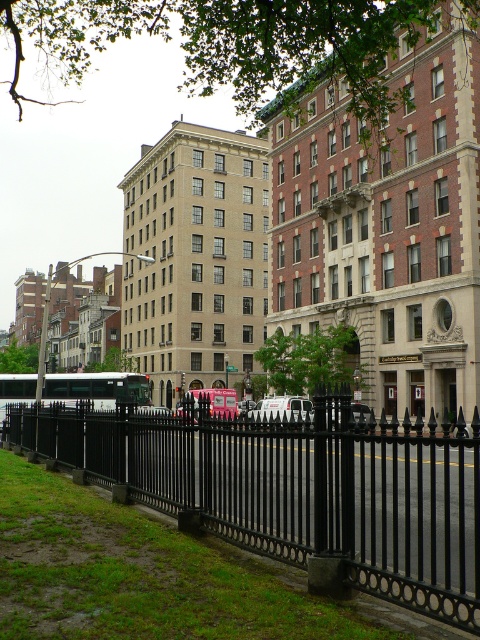
Question: Considering the real-world distances, which object is closest to the white matte bus at center?

Choices:
 (A) metallic silver bus at center
 (B) black wrought iron fence at lower left
 (C) white matte van at center

Answer: (B)

Question: Based on their relative distances, which object is farther from the metallic silver bus at center?

Choices:
 (A) black wrought iron fence at lower left
 (B) white matte bus at center

Answer: (B)

Question: Which of these objects is positioned closest to the black wrought iron fence at lower left?

Choices:
 (A) white matte bus at center
 (B) white matte van at center

Answer: (A)

Question: Considering the relative positions of black wrought iron fence at lower left and white matte van at center in the image provided, where is black wrought iron fence at lower left located with respect to white matte van at center?

Choices:
 (A) left
 (B) right

Answer: (A)

Question: Does white matte van at center appear on the right side of metallic silver bus at center?

Choices:
 (A) no
 (B) yes

Answer: (B)

Question: Is black wrought iron fence at lower left wider than white matte van at center?

Choices:
 (A) yes
 (B) no

Answer: (A)